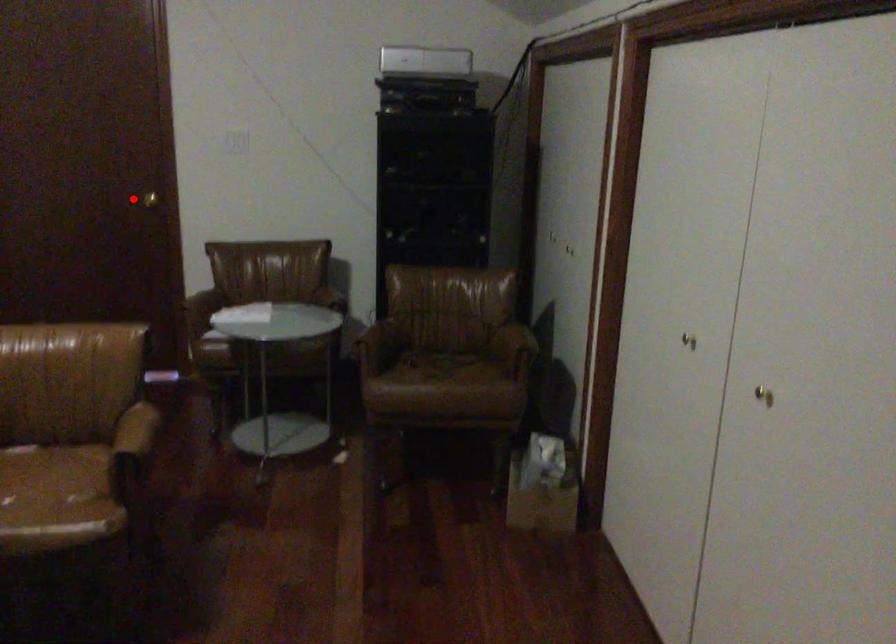
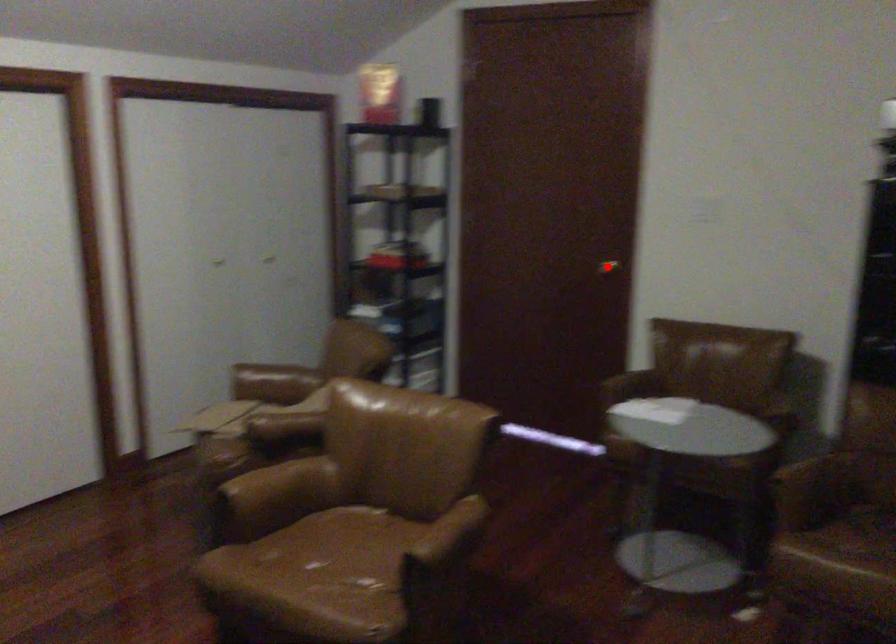
I am providing you with two images of the same scene from different viewpoints. A red point is marked on the first image and another point is marked on the second image. Is the red point in image1 aligned with the point shown in image2?

Yes